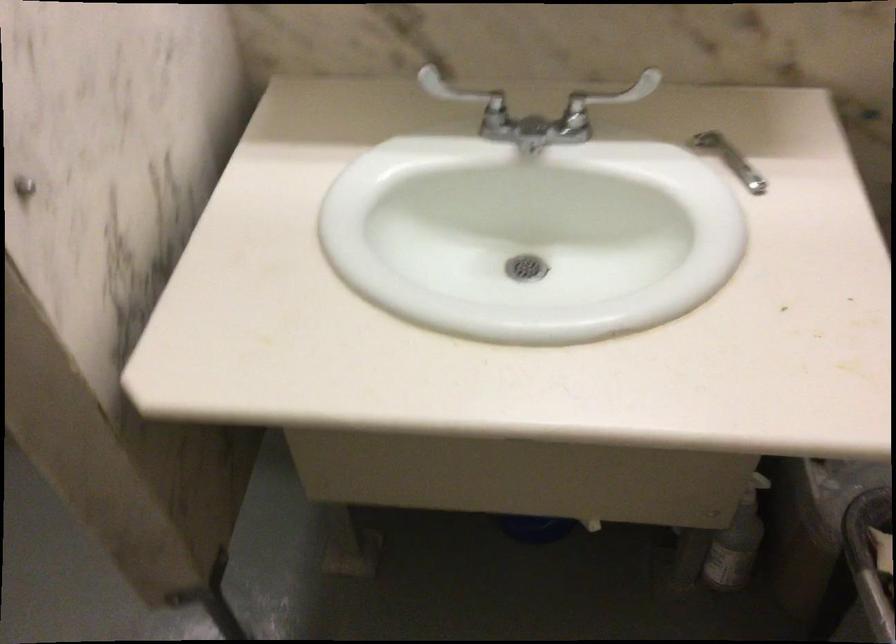
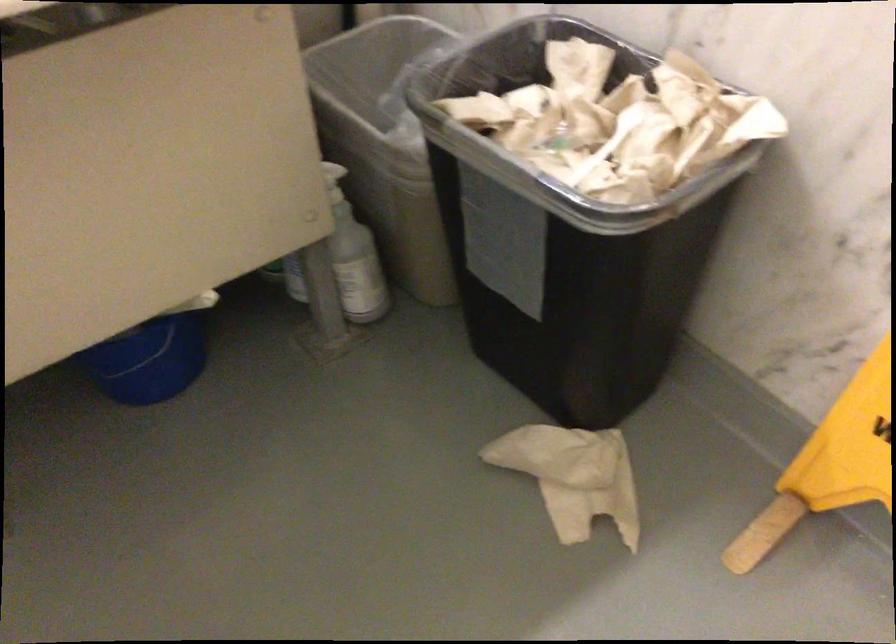
Find the pixel in the second image that matches the point at 520,514 in the first image.

(149, 361)